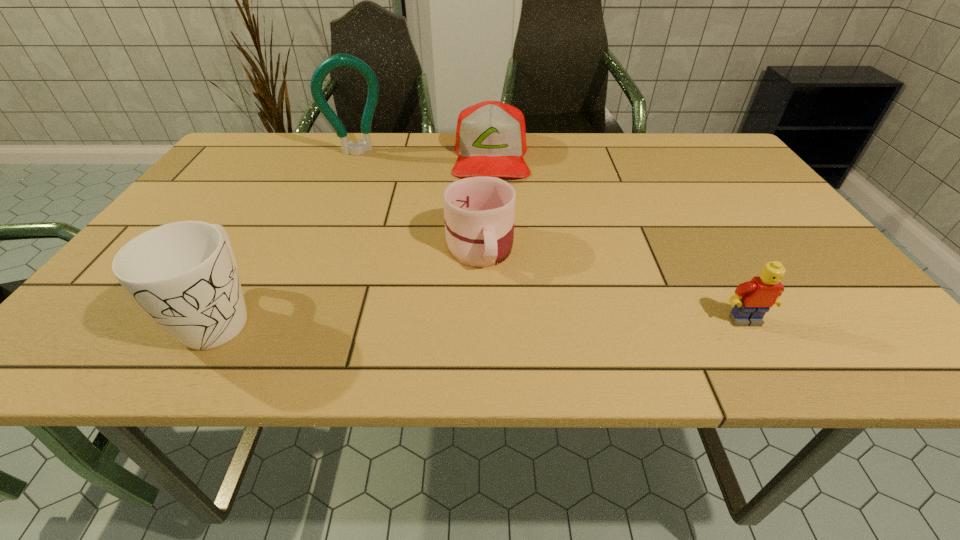
You are a GUI agent. You are given a task and a screenshot of the screen. Output one action in this format:
    pyautogui.click(x=<x>, y=<y>)
    Task: Click on the vacant space at the right edge of the desktop
    The height and width of the screenshot is (540, 960).
    Given the screenshot: What is the action you would take?
    pyautogui.click(x=752, y=190)

Identify the location of vacant space at the far left corner of the desktop. (228, 172).

Locate an element on the screen. The image size is (960, 540). vacant space at the far right corner is located at coordinates [713, 140].

Where is `free space between the left mug and the bottle opener`? free space between the left mug and the bottle opener is located at coordinates (290, 233).

Image resolution: width=960 pixels, height=540 pixels. Identify the location of vacant area that lies between the rightmost object and the second tallest object. (483, 318).

This screenshot has height=540, width=960. What are the coordinates of `vacant area that lies between the baseball cap and the Lego` in the screenshot? It's located at (617, 238).

Locate an element on the screen. Image resolution: width=960 pixels, height=540 pixels. unoccupied position between the bottle opener and the taller mug is located at coordinates (290, 233).

Find the location of `vacant area between the shorter mug and the left mug`. vacant area between the shorter mug and the left mug is located at coordinates (350, 280).

Find the location of a particular element. This screenshot has width=960, height=540. free area in between the second tallest object and the bottle opener is located at coordinates (290, 233).

At what (x,y) coordinates should I click in order to perform the action: click on free area in between the shorter mug and the Lego. Please return your answer as a coordinate pair (x, y). Looking at the image, I should click on (612, 283).